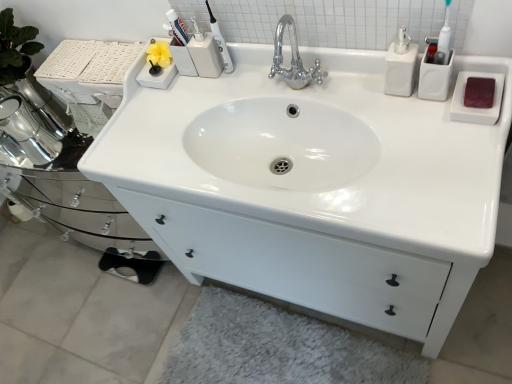
Question: From the image's perspective, is white glossy soap dispenser at upper right under white glossy sink at center?

Choices:
 (A) no
 (B) yes

Answer: (A)

Question: Is white glossy soap dispenser at upper right turned away from white glossy sink at center?

Choices:
 (A) yes
 (B) no

Answer: (A)

Question: Are white glossy soap dispenser at upper right and white glossy sink at center located far from each other?

Choices:
 (A) no
 (B) yes

Answer: (A)

Question: Would you say white glossy sink at center is part of white glossy soap dispenser at upper right's contents?

Choices:
 (A) yes
 (B) no

Answer: (B)

Question: From a real-world perspective, is white glossy soap dispenser at upper right located higher than white glossy sink at center?

Choices:
 (A) yes
 (B) no

Answer: (A)

Question: From the image's perspective, is white glossy sink at center positioned above or below white fluffy bath mat at lower center?

Choices:
 (A) above
 (B) below

Answer: (A)

Question: In terms of width, does white glossy sink at center look wider or thinner when compared to white fluffy bath mat at lower center?

Choices:
 (A) thin
 (B) wide

Answer: (B)

Question: Is white glossy sink at center bigger or smaller than white fluffy bath mat at lower center?

Choices:
 (A) small
 (B) big

Answer: (B)

Question: Considering their positions, is white glossy sink at center located in front of or behind white fluffy bath mat at lower center?

Choices:
 (A) front
 (B) behind

Answer: (A)

Question: Does point (126, 173) appear closer or farther from the camera than point (399, 34)?

Choices:
 (A) closer
 (B) farther

Answer: (B)

Question: Is white glossy sink at center to the left or to the right of white glossy soap dispenser at upper right in the image?

Choices:
 (A) right
 (B) left

Answer: (B)

Question: Is white glossy sink at center inside the boundaries of white glossy soap dispenser at upper right, or outside?

Choices:
 (A) inside
 (B) outside

Answer: (B)

Question: In terms of width, does white glossy sink at center look wider or thinner when compared to white glossy soap dispenser at upper right?

Choices:
 (A) thin
 (B) wide

Answer: (B)

Question: Based on their sizes in the image, would you say white fluffy bath mat at lower center is bigger or smaller than matte plastic toothbrush at upper center?

Choices:
 (A) big
 (B) small

Answer: (A)

Question: Is white fluffy bath mat at lower center wider or thinner than matte plastic toothbrush at upper center?

Choices:
 (A) wide
 (B) thin

Answer: (A)